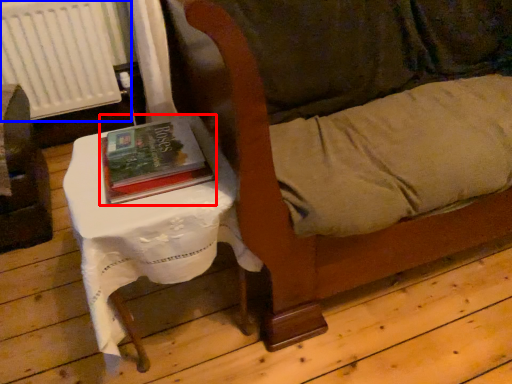
Question: Which point is closer to the camera, book (highlighted by a red box) or radiator (highlighted by a blue box)?

Choices:
 (A) book
 (B) radiator

Answer: (A)